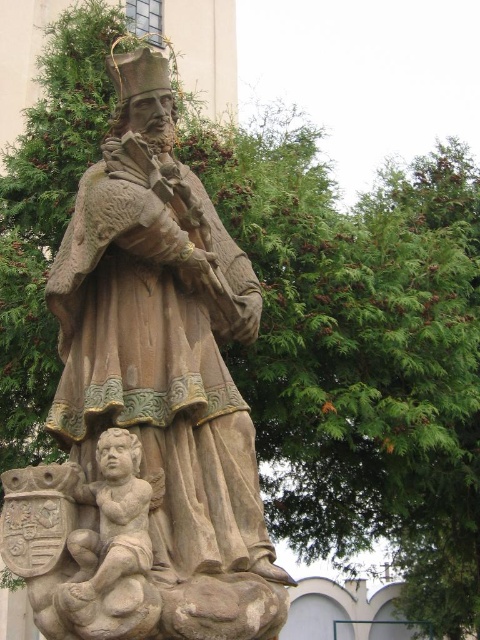
Does stone statue at center appear on the right side of smooth stone cherub at lower left?

Yes, stone statue at center is to the right of smooth stone cherub at lower left.

Which is in front, point (183, 596) or point (131, 524)?

Point (183, 596) is in front.

Identify the location of stone statue at center. The height and width of the screenshot is (640, 480). (146, 406).